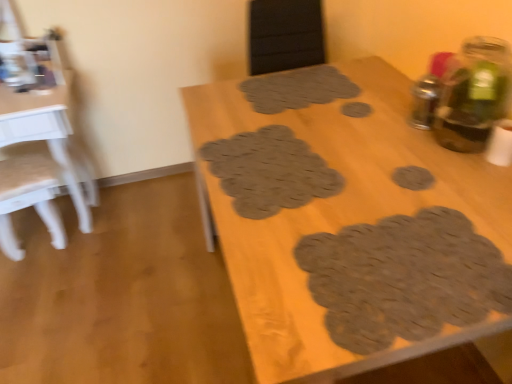
What is the approximate height of white glossy table at left, which is the second table in right-to-left order?

white glossy table at left, which is the second table in right-to-left order, is 29.14 inches tall.

What is the approximate width of white glossy table at left, which is the second table in right-to-left order?

It is 18.50 inches.

What do you see at coordinates (337, 214) in the screenshot? The width and height of the screenshot is (512, 384). I see `brown textured placemats at center, which is the 1th table from right to left` at bounding box center [337, 214].

Where is `brown textured mat at center, marked as the first footprint in a back-to-front arrangement`? The height and width of the screenshot is (384, 512). brown textured mat at center, marked as the first footprint in a back-to-front arrangement is located at coordinates (297, 89).

You are a GUI agent. You are given a task and a screenshot of the screen. Output one action in this format:
    pyautogui.click(x=<x>, y=<y>)
    Task: Click on the brown textured mat at center, the third footprint ordered from the bottom
    The image size is (512, 384).
    Given the screenshot: What is the action you would take?
    pyautogui.click(x=269, y=171)

Considering the positions of points (362, 112) and (196, 98), is point (362, 112) closer to camera compared to point (196, 98)?

Yes, it is in front of point (196, 98).

Does brown felt coaster at center, the fourth footprint positioned from the front, have a lesser width compared to brown textured placemats at center, which appears as the 2th table when viewed from the left?

Indeed, brown felt coaster at center, the fourth footprint positioned from the front, has a lesser width compared to brown textured placemats at center, which appears as the 2th table when viewed from the left.

Would you say brown felt coaster at center, the fourth footprint positioned from the front, is inside or outside brown textured placemats at center, which appears as the 2th table when viewed from the left?

brown felt coaster at center, the fourth footprint positioned from the front, is located inside brown textured placemats at center, which appears as the 2th table when viewed from the left.

From the image's perspective, does brown textured mat at center, positioned as the 3th footprint in top-to-bottom order, appear lower than green glass bottle at upper right, the 2th bottle from the back?

Correct, brown textured mat at center, positioned as the 3th footprint in top-to-bottom order, appears lower than green glass bottle at upper right, the 2th bottle from the back, in the image.

Considering the relative positions of brown textured mat at center, which appears as the 4th footprint when viewed from the back, and green glass bottle at upper right, the 2th bottle from the back, in the image provided, is brown textured mat at center, which appears as the 4th footprint when viewed from the back, to the right of green glass bottle at upper right, the 2th bottle from the back, from the viewer's perspective?

In fact, brown textured mat at center, which appears as the 4th footprint when viewed from the back, is to the left of green glass bottle at upper right, the 2th bottle from the back.

Between brown textured mat at center, the third footprint ordered from the bottom, and green glass bottle at upper right, the 2th bottle from the back, which one has smaller size?

brown textured mat at center, the third footprint ordered from the bottom.

Locate an element on the screen. The width and height of the screenshot is (512, 384). the 2nd bottle to the right when counting from the brown textured mat at center, the third footprint ordered from the bottom is located at coordinates (473, 94).

Could you tell me if metallic silver bottle at upper right, the second bottle viewed from the front, is turned towards brown textured mat at center, the third footprint ordered from the bottom?

Yes, metallic silver bottle at upper right, the second bottle viewed from the front, is aimed at brown textured mat at center, the third footprint ordered from the bottom.

Considering the sizes of objects metallic silver bottle at upper right, the second bottle viewed from the front, and brown textured mat at center, arranged as the second footprint when viewed from the front, in the image provided, who is bigger, metallic silver bottle at upper right, the second bottle viewed from the front, or brown textured mat at center, arranged as the second footprint when viewed from the front,?

Bigger between the two is metallic silver bottle at upper right, the second bottle viewed from the front.

The width and height of the screenshot is (512, 384). I want to click on the 1st bottle to the right of the brown textured mat at center, positioned as the 3th footprint in top-to-bottom order, starting your count from the anchor, so click(x=425, y=101).

Is brown textured mat at center, positioned as the 3th footprint in top-to-bottom order, completely or partially inside metallic silver bottle at upper right, which is counted as the first bottle, starting from the back?

That's incorrect, brown textured mat at center, positioned as the 3th footprint in top-to-bottom order, is not inside metallic silver bottle at upper right, which is counted as the first bottle, starting from the back.

Considering the relative positions of white glossy table at left, marked as the first table in a left-to-right arrangement, and brown textured placemats at center, which appears as the 2th table when viewed from the left, in the image provided, is white glossy table at left, marked as the first table in a left-to-right arrangement, to the right of brown textured placemats at center, which appears as the 2th table when viewed from the left, from the viewer's perspective?

No, white glossy table at left, marked as the first table in a left-to-right arrangement, is not to the right of brown textured placemats at center, which appears as the 2th table when viewed from the left.

From the image's perspective, which is above, white glossy table at left, marked as the first table in a left-to-right arrangement, or brown textured placemats at center, which appears as the 2th table when viewed from the left?

white glossy table at left, marked as the first table in a left-to-right arrangement, from the image's perspective.

Considering the sizes of objects white glossy table at left, marked as the first table in a left-to-right arrangement, and brown textured placemats at center, which appears as the 2th table when viewed from the left, in the image provided, who is wider, white glossy table at left, marked as the first table in a left-to-right arrangement, or brown textured placemats at center, which appears as the 2th table when viewed from the left,?

Wider between the two is brown textured placemats at center, which appears as the 2th table when viewed from the left.

Is white glossy table at left, which is the second table in right-to-left order, positioned with its back to brown textured placemats at center, which appears as the 2th table when viewed from the left?

No, white glossy table at left, which is the second table in right-to-left order,'s orientation is not away from brown textured placemats at center, which appears as the 2th table when viewed from the left.

Are brown textured mat at center, the 5th footprint in the bottom-to-top sequence, and brown textured mat at center, arranged as the second footprint when viewed from the front, far apart?

brown textured mat at center, the 5th footprint in the bottom-to-top sequence, is actually quite close to brown textured mat at center, arranged as the second footprint when viewed from the front.

Is brown textured mat at center, the 5th footprint in the bottom-to-top sequence, in front of or behind brown textured mat at center, arranged as the second footprint when viewed from the front, in the image?

Visually, brown textured mat at center, the 5th footprint in the bottom-to-top sequence, is located behind brown textured mat at center, arranged as the second footprint when viewed from the front.

Can you confirm if brown textured mat at center, the 5th footprint from the front, is smaller than brown textured mat at center, the third footprint ordered from the bottom?

Incorrect, brown textured mat at center, the 5th footprint from the front, is not smaller in size than brown textured mat at center, the third footprint ordered from the bottom.

Considering the relative sizes of brown textured mat at center, the 5th footprint in the bottom-to-top sequence, and brown textured mat at center, the third footprint ordered from the bottom, in the image provided, is brown textured mat at center, the 5th footprint in the bottom-to-top sequence, wider than brown textured mat at center, the third footprint ordered from the bottom,?

Correct, the width of brown textured mat at center, the 5th footprint in the bottom-to-top sequence, exceeds that of brown textured mat at center, the third footprint ordered from the bottom.

Who is more distant, brown textured placemats at center, which appears as the 2th table when viewed from the left, or metallic silver bottle at upper right, the second bottle viewed from the front?

metallic silver bottle at upper right, the second bottle viewed from the front, is behind.

Is brown textured placemats at center, which is the 1th table from right to left, bigger than metallic silver bottle at upper right, which is counted as the first bottle, starting from the back?

Yes.

How different are the orientations of brown textured placemats at center, which appears as the 2th table when viewed from the left, and metallic silver bottle at upper right, the second bottle viewed from the front, in degrees?

The angular difference between brown textured placemats at center, which appears as the 2th table when viewed from the left, and metallic silver bottle at upper right, the second bottle viewed from the front, is 1.9 degrees.

From a real-world perspective, which is physically above, brown textured placemats at center, which is the 1th table from right to left, or metallic silver bottle at upper right, the second bottle viewed from the front?

metallic silver bottle at upper right, the second bottle viewed from the front, is physically above.

Considering the relative sizes of white glossy table at left, which is the second table in right-to-left order, and brown textured mat at bottom right, which is the 1th footprint in front-to-back order, in the image provided, is white glossy table at left, which is the second table in right-to-left order, shorter than brown textured mat at bottom right, which is the 1th footprint in front-to-back order,?

Incorrect, the height of white glossy table at left, which is the second table in right-to-left order, does not fall short of that of brown textured mat at bottom right, which is the 1th footprint in front-to-back order.

From a real-world perspective, which object stands above the other?

brown textured mat at bottom right, which is the 1th footprint in front-to-back order, is physically above.

Consider the image. Considering the relative sizes of white glossy table at left, marked as the first table in a left-to-right arrangement, and brown textured mat at bottom right, which is the 1th footprint in front-to-back order, in the image provided, is white glossy table at left, marked as the first table in a left-to-right arrangement, thinner than brown textured mat at bottom right, which is the 1th footprint in front-to-back order,?

In fact, white glossy table at left, marked as the first table in a left-to-right arrangement, might be wider than brown textured mat at bottom right, which is the 1th footprint in front-to-back order.

I want to click on the 4th footprint behind the brown textured placemats at center, which is the 1th table from right to left, so click(x=356, y=109).

This screenshot has height=384, width=512. Find the location of `bottle in front of the brown textured mat at center, the third footprint ordered from the bottom`. bottle in front of the brown textured mat at center, the third footprint ordered from the bottom is located at coordinates (473, 94).

Considering their positions, is brown textured mat at center, arranged as the second footprint when viewed from the front, positioned further to brown textured coaster at center-right, which ranks as the third footprint in back-to-front order, than brown textured placemats at center, which is the 1th table from right to left?

The object further to brown textured coaster at center-right, which ranks as the third footprint in back-to-front order, is brown textured placemats at center, which is the 1th table from right to left.

Estimate the real-world distances between objects in this image. Which object is closer to white glossy table at left, marked as the first table in a left-to-right arrangement, brown textured mat at center, which appears as the 4th footprint when viewed from the back, or brown textured mat at center, marked as the first footprint in a back-to-front arrangement?

brown textured mat at center, marked as the first footprint in a back-to-front arrangement.

Considering their positions, is metallic silver bottle at upper right, which is counted as the first bottle, starting from the back, positioned further to green glass bottle at upper right, the 2th bottle from the back, than brown textured coaster at center-right, the third footprint positioned from the front?

The object further to green glass bottle at upper right, the 2th bottle from the back, is brown textured coaster at center-right, the third footprint positioned from the front.

Which object lies further to the anchor point brown textured mat at center, the third footprint ordered from the bottom, metallic silver bottle at upper right, the second bottle viewed from the front, or white glossy table at left, marked as the first table in a left-to-right arrangement?

Based on the image, white glossy table at left, marked as the first table in a left-to-right arrangement, appears to be further to brown textured mat at center, the third footprint ordered from the bottom.

Estimate the real-world distances between objects in this image. Which object is further from metallic silver bottle at upper right, the second bottle viewed from the front, brown textured mat at center, which is the first footprint in top-to-bottom order, or brown textured placemats at center, which is the 1th table from right to left?

Based on the image, brown textured mat at center, which is the first footprint in top-to-bottom order, appears to be further to metallic silver bottle at upper right, the second bottle viewed from the front.

Looking at the image, which one is located closer to green glass bottle at upper right, acting as the 1th bottle starting from the front, brown textured mat at center, arranged as the second footprint when viewed from the front, or brown textured coaster at center-right, the second footprint in the bottom-to-top sequence?

brown textured coaster at center-right, the second footprint in the bottom-to-top sequence, lies closer to green glass bottle at upper right, acting as the 1th bottle starting from the front, than the other object.

Which object lies further to the anchor point brown textured mat at center, the third footprint ordered from the bottom, brown felt coaster at center, which is counted as the 2th footprint, starting from the back, or brown textured mat at center, which is the first footprint in top-to-bottom order?

brown felt coaster at center, which is counted as the 2th footprint, starting from the back, is positioned further to the anchor brown textured mat at center, the third footprint ordered from the bottom.

From the image, which object appears to be farther from brown textured mat at center, positioned as the 3th footprint in top-to-bottom order, brown felt coaster at center, which is counted as the 2th footprint, starting from the back, or metallic silver bottle at upper right, the second bottle viewed from the front?

metallic silver bottle at upper right, the second bottle viewed from the front, is positioned further to the anchor brown textured mat at center, positioned as the 3th footprint in top-to-bottom order.

The height and width of the screenshot is (384, 512). Find the location of `bottle between green glass bottle at upper right, acting as the 1th bottle starting from the front, and brown felt coaster at center, acting as the 2th footprint starting from the top, in the front-back direction`. bottle between green glass bottle at upper right, acting as the 1th bottle starting from the front, and brown felt coaster at center, acting as the 2th footprint starting from the top, in the front-back direction is located at coordinates (425, 101).

Locate an element on the screen. This screenshot has height=384, width=512. bottle between brown textured coaster at center-right, the second footprint in the bottom-to-top sequence, and brown textured mat at center, the 5th footprint from the front, from front to back is located at coordinates (425, 101).

This screenshot has height=384, width=512. I want to click on table between white glossy table at left, marked as the first table in a left-to-right arrangement, and brown textured mat at bottom right, marked as the fifth footprint in a top-to-bottom arrangement, from left to right, so click(337, 214).

Image resolution: width=512 pixels, height=384 pixels. In order to click on table between white glossy table at left, marked as the first table in a left-to-right arrangement, and brown textured coaster at center-right, which ranks as the third footprint in back-to-front order in this screenshot , I will do `click(337, 214)`.